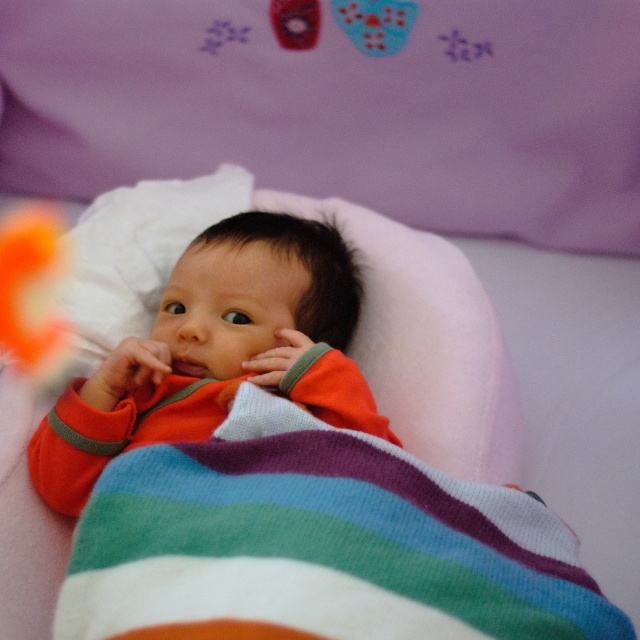
Question: Is pink soft pillow at upper center wider than orange plush toy at left?

Choices:
 (A) no
 (B) yes

Answer: (B)

Question: Can you confirm if orange soft fabric baby at center is bigger than orange plush toy at left?

Choices:
 (A) no
 (B) yes

Answer: (B)

Question: Which object is the closest to the multicolored knitted blanket at center?

Choices:
 (A) orange soft fabric baby at center
 (B) orange plush toy at left
 (C) pink soft pillow at upper center

Answer: (A)

Question: Can you confirm if pink soft pillow at upper center is positioned above orange soft fabric baby at center?

Choices:
 (A) no
 (B) yes

Answer: (B)

Question: Which is nearer to the orange soft fabric baby at center?

Choices:
 (A) multicolored knitted blanket at center
 (B) orange plush toy at left

Answer: (A)

Question: Which point is farther from the camera taking this photo?

Choices:
 (A) (358, 154)
 (B) (323, 552)

Answer: (A)